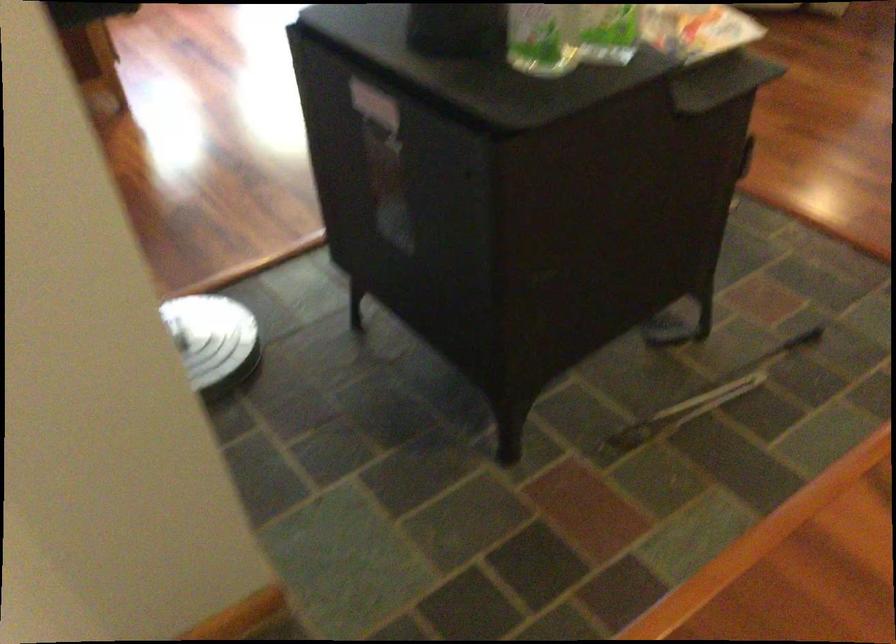
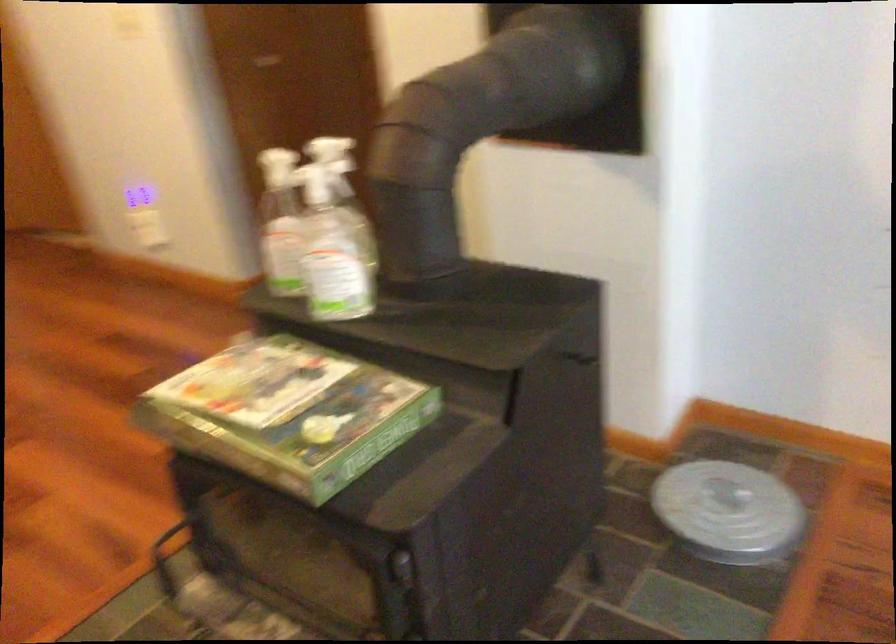
Find the pixel in the second image that matches [200,307] in the first image.

(728, 512)